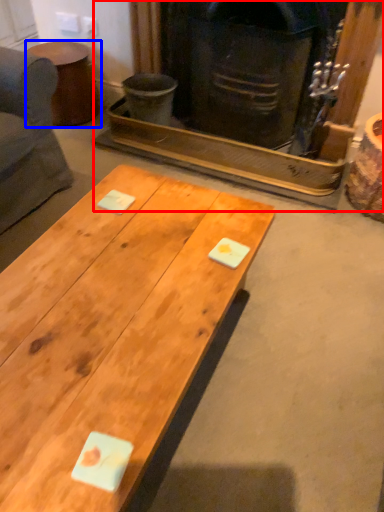
Question: Which object is closer to the camera taking this photo, fireplace (highlighted by a red box) or side table (highlighted by a blue box)?

Choices:
 (A) fireplace
 (B) side table

Answer: (A)